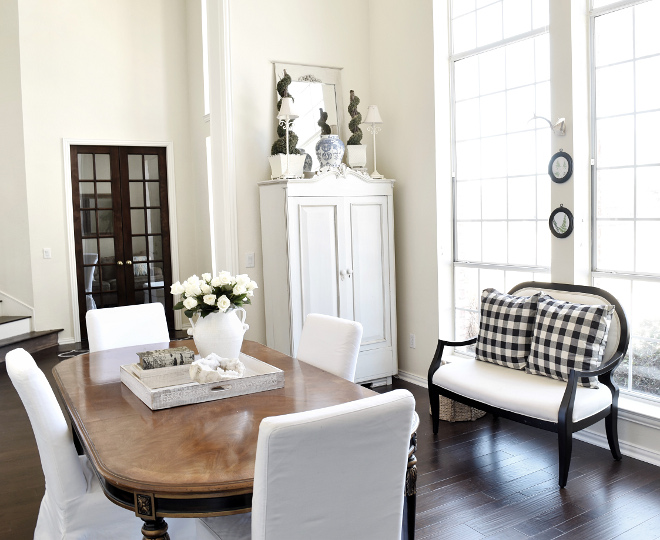
Locate an element on the screen. This screenshot has height=540, width=660. door knob is located at coordinates (121, 263).